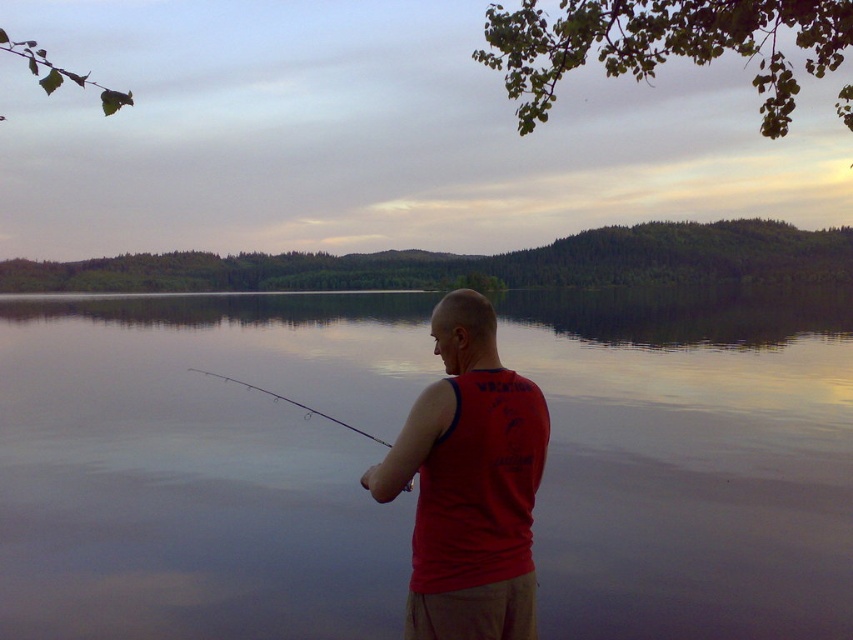
You are a photographer planning to take a wide shot of the scene. The smooth water at center and the red matte tank top at center are both in your frame. Considering their sizes, which object would occupy more space in your photo?

The smooth water at center has a larger size compared to the red matte tank top at center, so it would occupy more space in the photo.

You are a photographer positioned at the lakeside and want to capture a photo where the smooth water at center is in focus while keeping the red matte tank top at center somewhat blurred. Is this possible with your current camera settings?

The smooth water at center is further to the viewer than the red matte tank top at center, so adjusting the camera focus to the water and using a shallow depth of field could blur the foreground tank top, making it possible.

You are a drone operator trying to land a drone on the smooth water at center. The drone has a landing pad that must be placed exactly at point (202,465). According to the scene description, is the landing pad location on stable water?

Yes, the landing pad location at point (202,465) is on smooth water at center, which is stable enough for the drone to land safely.